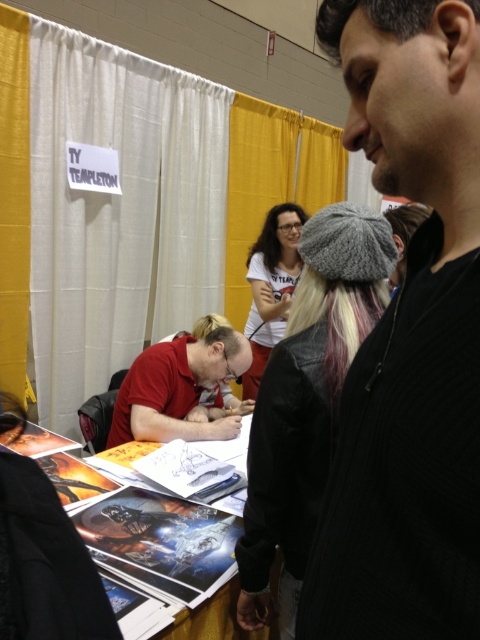
Question: Is black knit cap at upper right positioned before red matte shirt at center?

Choices:
 (A) no
 (B) yes

Answer: (B)

Question: Which point appears farthest from the camera in this image?

Choices:
 (A) (171, 410)
 (B) (277, 321)
 (C) (420, 404)
 (D) (333, 362)

Answer: (B)

Question: Which point is closer to the camera?

Choices:
 (A) white matte t-shirt at center
 (B) gray knit hat at upper center
 (C) red matte shirt at center

Answer: (B)

Question: Is gray knit hat at upper center bigger than white matte t-shirt at center?

Choices:
 (A) no
 (B) yes

Answer: (A)

Question: Which object is positioned closest to the white matte t-shirt at center?

Choices:
 (A) black knit cap at upper right
 (B) red matte shirt at center

Answer: (B)

Question: Does gray knit hat at upper center lie in front of red matte shirt at center?

Choices:
 (A) yes
 (B) no

Answer: (A)